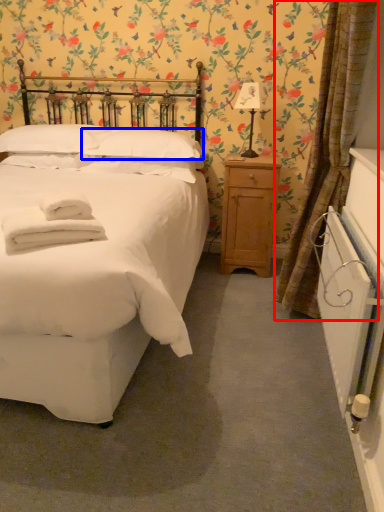
Question: Which object appears farthest to the camera in this image, curtain (highlighted by a red box) or pillow (highlighted by a blue box)?

Choices:
 (A) curtain
 (B) pillow

Answer: (B)